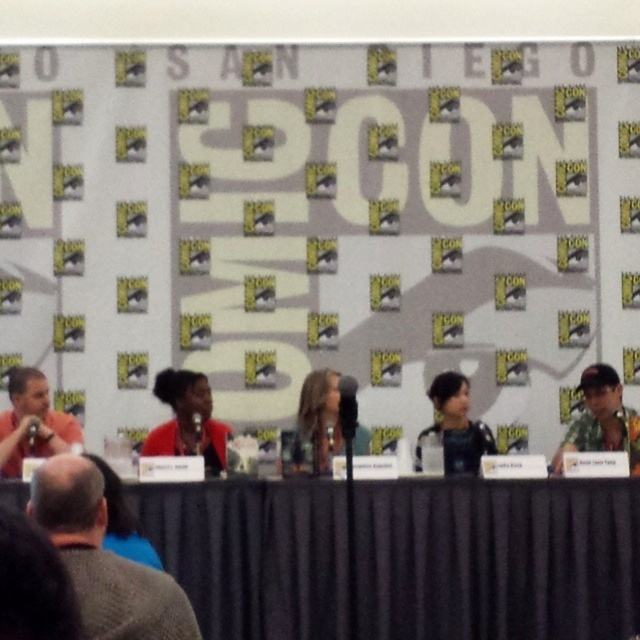
You are an event organizer at SDCC and need to ensure that all jackets on the panel table are visible to the audience. The matte red jacket at center and the black matte jacket at center are both placed on the table. Given their sizes, which jacket might be more likely to block the view of the panelists behind them?

The matte red jacket at center is larger in size than the black matte jacket at center, so it might block the view more than the black one.

From the picture: You are attending SDCC and want to take a photo of the matte orange shirt at left without including the black fabric table at lower center. Given their spatial relationship, is this feasible?

The black fabric table at lower center might be wider than matte orange shirt at left, so there is a possibility that the table could obstruct the view of the shirt depending on your angle and distance. To ensure the shirt is visible without the table, position yourself to the side opposite the table or move closer to frame the shirt carefully.